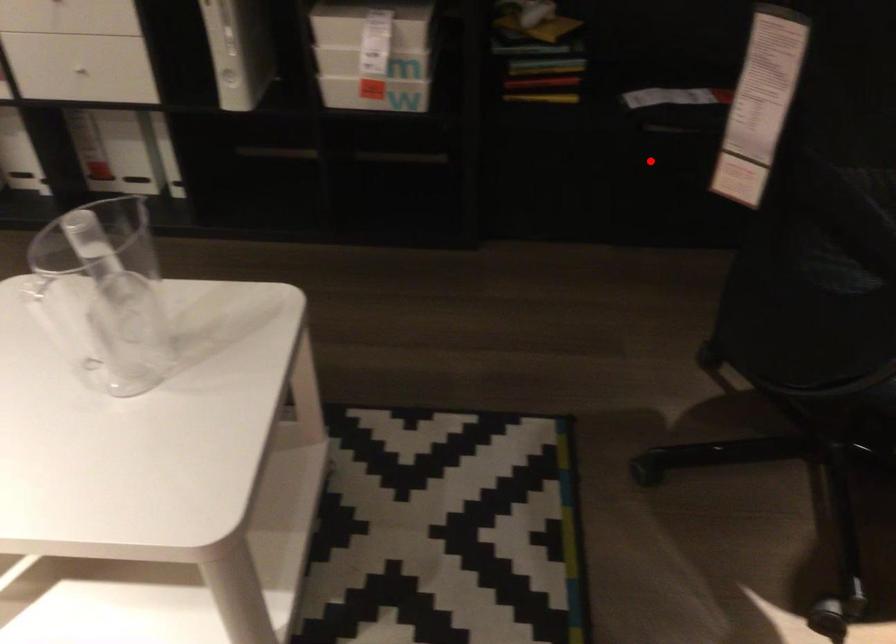
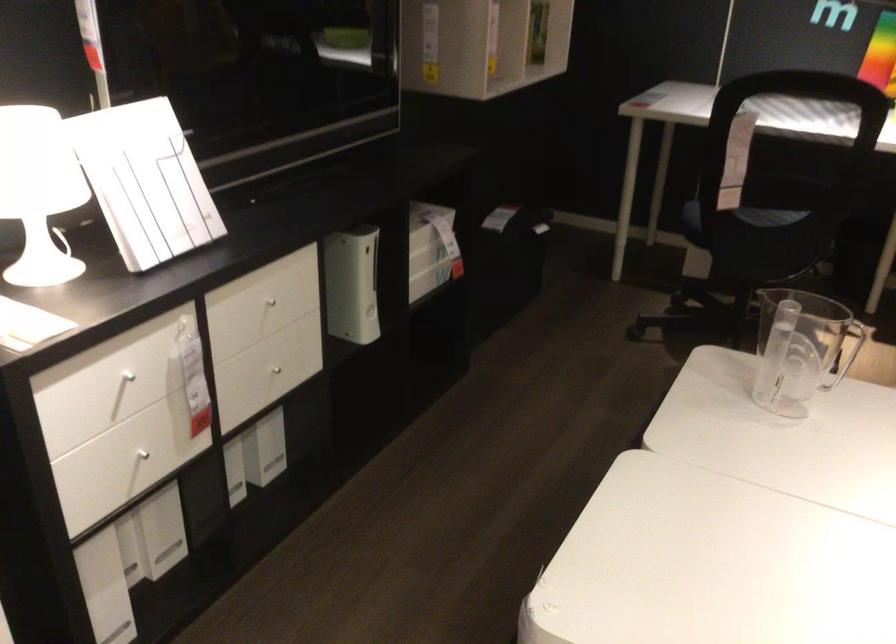
In the second image, find the point that corresponds to the highlighted location in the first image.

(507, 263)